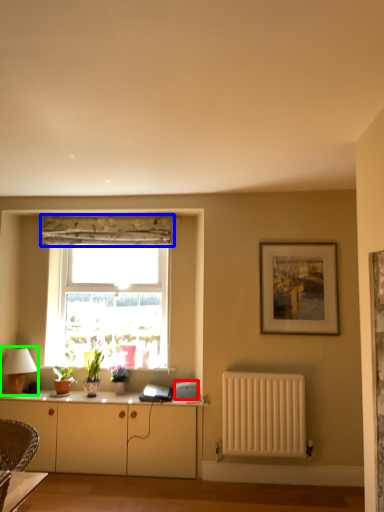
Question: Which object is positioned farthest from appliance (highlighted by a red box)? Select from curtain (highlighted by a blue box) and table lamp (highlighted by a green box).

Choices:
 (A) curtain
 (B) table lamp

Answer: (A)